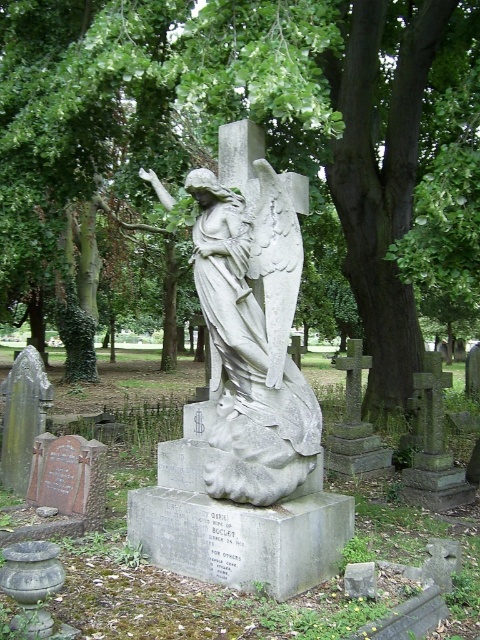
The width and height of the screenshot is (480, 640). What do you see at coordinates (269, 140) in the screenshot?
I see `green leafy tree at center` at bounding box center [269, 140].

Who is lower down, green leafy tree at center or gray stone angel at center?

gray stone angel at center is below.

You are a GUI agent. You are given a task and a screenshot of the screen. Output one action in this format:
    pyautogui.click(x=<x>, y=<y>)
    Task: Click on the green leafy tree at center
    Image resolution: width=480 pixels, height=640 pixels.
    Given the screenshot: What is the action you would take?
    pyautogui.click(x=269, y=140)